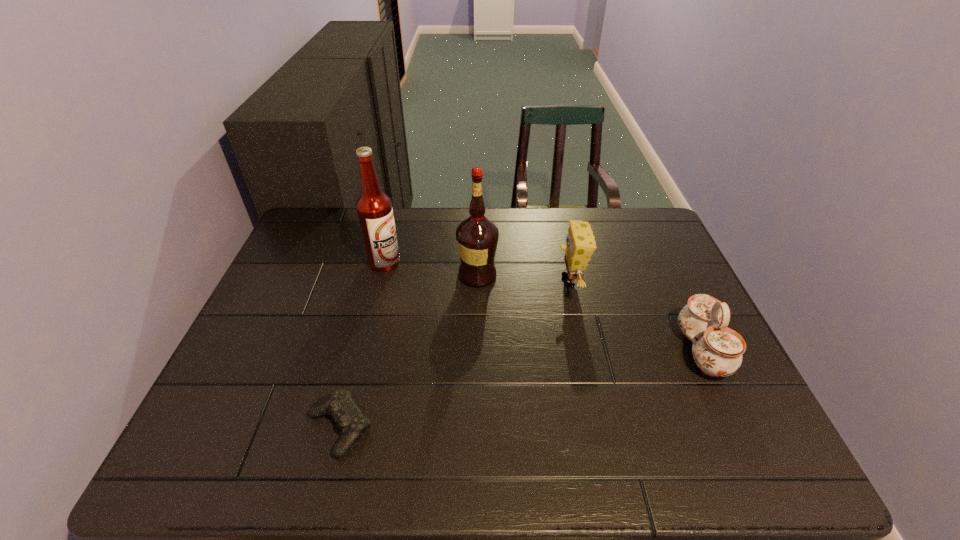
You are a GUI agent. You are given a task and a screenshot of the screen. Output one action in this format:
    pyautogui.click(x=<x>, y=<y>)
    Task: Click on the unoccupied position between the left alcohol and the right alcohol
    This screenshot has width=960, height=540.
    Given the screenshot: What is the action you would take?
    pyautogui.click(x=431, y=269)

The image size is (960, 540). What are the coordinates of `blank region between the right alcohol and the sponge` in the screenshot? It's located at (523, 278).

Find the location of a particular element. The height and width of the screenshot is (540, 960). object that is the fourth closest to the third object from right to left is located at coordinates (717, 350).

Point out which object is positioned as the second nearest to the shortest object. Please provide its 2D coordinates. Your answer should be formatted as a tuple, i.e. [(x, y)], where the tuple contains the x and y coordinates of a point satisfying the conditions above.

[(374, 209)]

Where is `free space that satisfies the following two spatial constraints: 1. on the face of the sponge; 2. on the front side of the shortest object`? This screenshot has height=540, width=960. free space that satisfies the following two spatial constraints: 1. on the face of the sponge; 2. on the front side of the shortest object is located at coordinates (602, 428).